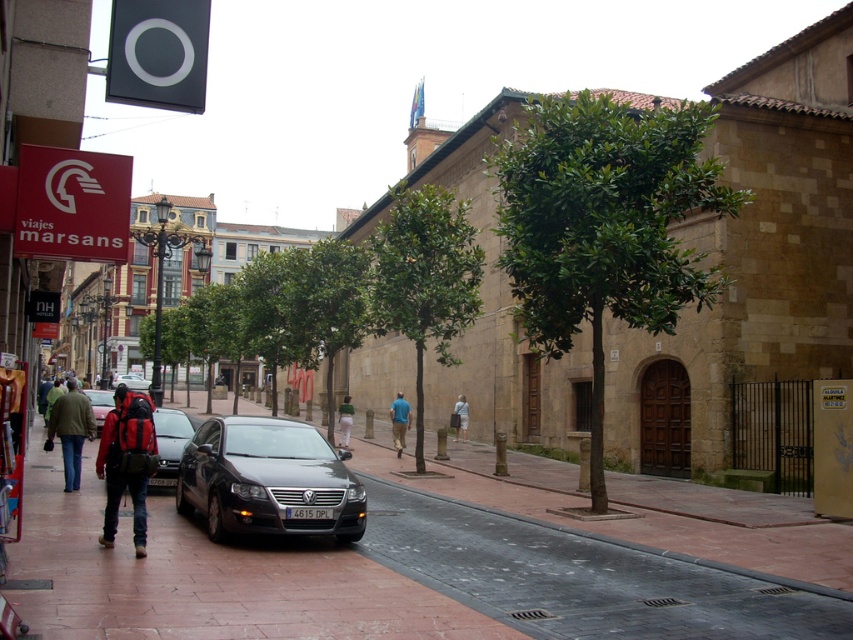
Can you confirm if satin black car at center is shorter than khaki fabric jacket at left?

No, satin black car at center is not shorter than khaki fabric jacket at left.

Does satin black car at center have a lesser width compared to khaki fabric jacket at left?

No, satin black car at center is not thinner than khaki fabric jacket at left.

Is point (320, 531) closer to camera compared to point (64, 403)?

That is True.

Locate an element on the screen. satin black car at center is located at coordinates (268, 481).

Does shiny black sedan at center-left lie behind green fabric pants at center?

No, shiny black sedan at center-left is in front of green fabric pants at center.

Does shiny black sedan at center-left have a greater width compared to green fabric pants at center?

Indeed, shiny black sedan at center-left has a greater width compared to green fabric pants at center.

Image resolution: width=853 pixels, height=640 pixels. What are the coordinates of `shiny black sedan at center-left` in the screenshot? It's located at (99, 404).

Is blue cotton shirt at center smaller than silver metallic sedan at center?

Indeed, blue cotton shirt at center has a smaller size compared to silver metallic sedan at center.

Is blue cotton shirt at center positioned behind silver metallic sedan at center?

No, blue cotton shirt at center is closer to the viewer.

Image resolution: width=853 pixels, height=640 pixels. Find the location of `blue cotton shirt at center`. blue cotton shirt at center is located at coordinates (399, 420).